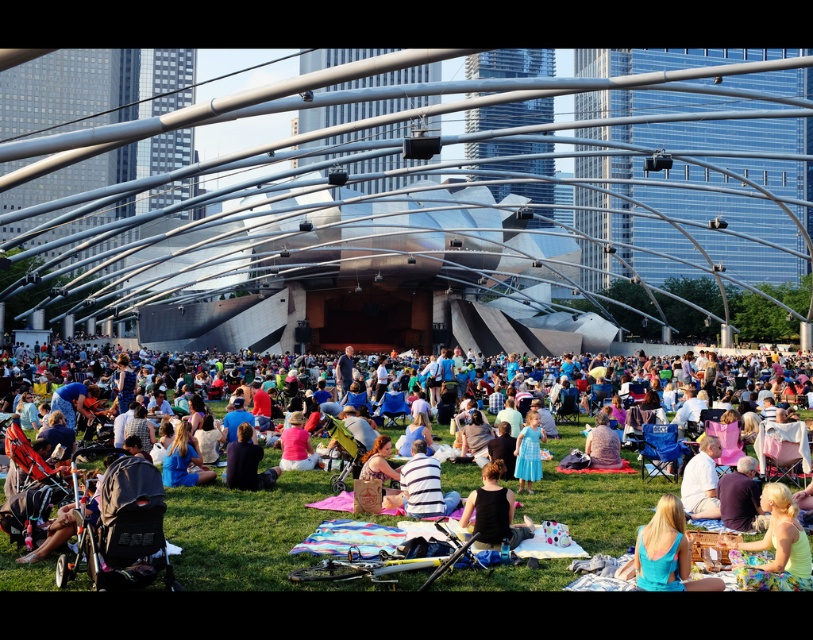
Between point (729, 509) and point (596, 445), which one is positioned in front?

Point (729, 509)

The width and height of the screenshot is (813, 640). What are the coordinates of `dark purple shirt at lower right` in the screenshot? It's located at (740, 497).

Who is more distant from viewer, (725, 509) or (588, 445)?

Positioned behind is point (588, 445).

Locate an element on the screen. dark purple shirt at lower right is located at coordinates (740, 497).

From the picture: Does white cotton shirt at center appear on the left side of light blue satin dress at center?

Correct, you'll find white cotton shirt at center to the left of light blue satin dress at center.

Does white cotton shirt at center appear over light blue satin dress at center?

No, white cotton shirt at center is not above light blue satin dress at center.

This screenshot has height=640, width=813. I want to click on white cotton shirt at center, so click(x=244, y=531).

Identify the location of white cotton shirt at center. (244, 531).

Which is in front, point (687, 564) or point (477, 496)?

Positioned in front is point (687, 564).

Where is `matte blue dress at lower right`? This screenshot has height=640, width=813. matte blue dress at lower right is located at coordinates (666, 552).